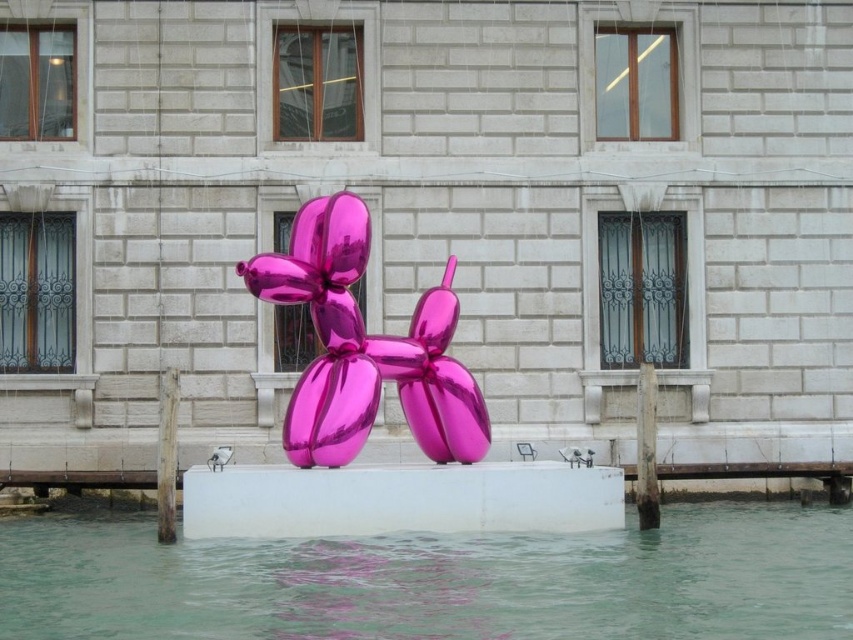
Is transparent water at center smaller than metallic pink balloon at center?

No.

Which is behind, point (55, 586) or point (347, 332)?

The point (347, 332) is more distant.

Is point (274, 557) more distant than point (309, 266)?

No.

Locate an element on the screen. This screenshot has width=853, height=640. transparent water at center is located at coordinates (438, 580).